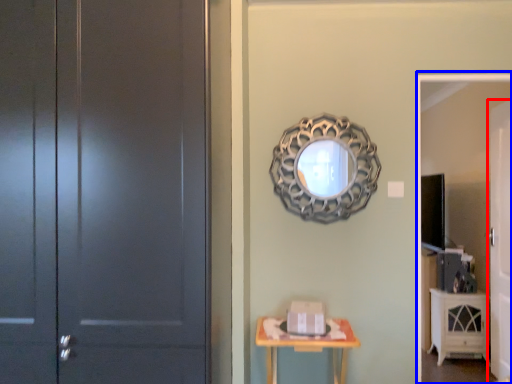
Question: Which point is further to the camera, door (highlighted by a red box) or screen door (highlighted by a blue box)?

Choices:
 (A) door
 (B) screen door

Answer: (A)